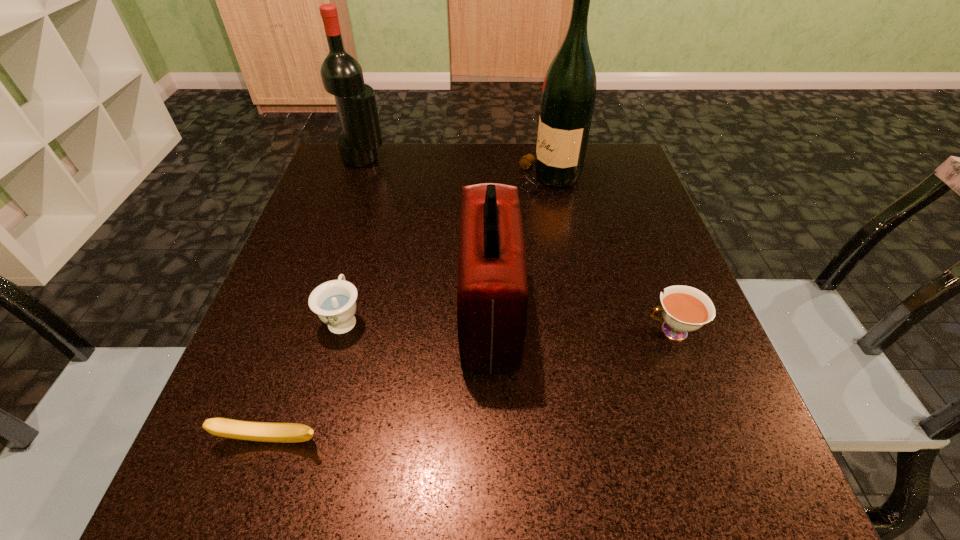
Locate an element on the screen. The image size is (960, 540). free space located on the side of the right teacup with the handle is located at coordinates (508, 331).

Locate an element on the screen. The height and width of the screenshot is (540, 960). vacant space located on the side of the right teacup with the handle is located at coordinates (608, 331).

You are a GUI agent. You are given a task and a screenshot of the screen. Output one action in this format:
    pyautogui.click(x=<x>, y=<y>)
    Task: Click on the free region located at the stem of the shortest object
    
    Given the screenshot: What is the action you would take?
    pos(246,516)

Identify the location of object present at the near edge. This screenshot has width=960, height=540. (236, 429).

You are a GUI agent. You are given a task and a screenshot of the screen. Output one action in this format:
    pyautogui.click(x=<x>, y=<y>)
    Task: Click on the wine bottle positioned at the left edge
    
    Given the screenshot: What is the action you would take?
    pyautogui.click(x=342, y=76)

Where is `teacup at the left edge`? The image size is (960, 540). teacup at the left edge is located at coordinates (334, 302).

This screenshot has width=960, height=540. In order to click on banana located in the left edge section of the desktop in this screenshot , I will do [236, 429].

Find the location of `wine bottle at the right edge`. wine bottle at the right edge is located at coordinates (568, 97).

Where is `teacup situated at the right edge`? This screenshot has width=960, height=540. teacup situated at the right edge is located at coordinates click(684, 309).

The width and height of the screenshot is (960, 540). Find the location of `object located at the far left corner`. object located at the far left corner is located at coordinates pyautogui.click(x=342, y=76).